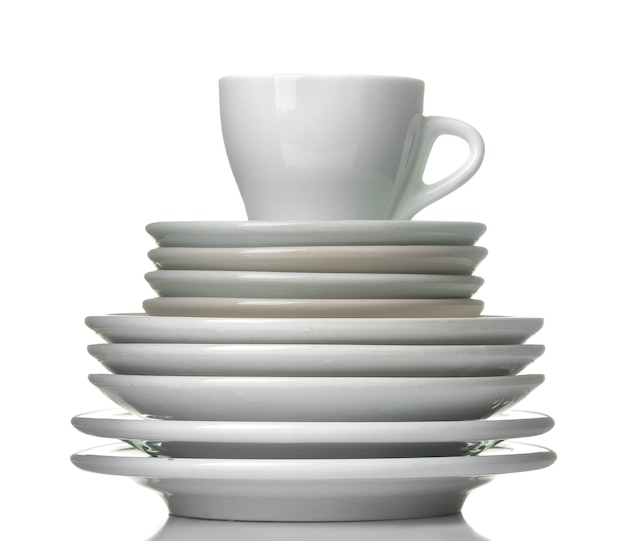
At what (x,y) coordinates should I click in order to perform the action: click on plates. Please return your answer as a coordinate pair (x, y). This screenshot has width=626, height=541. Looking at the image, I should click on (342, 232), (339, 260), (340, 282), (340, 312), (346, 332), (350, 360), (349, 400), (347, 437), (347, 477).